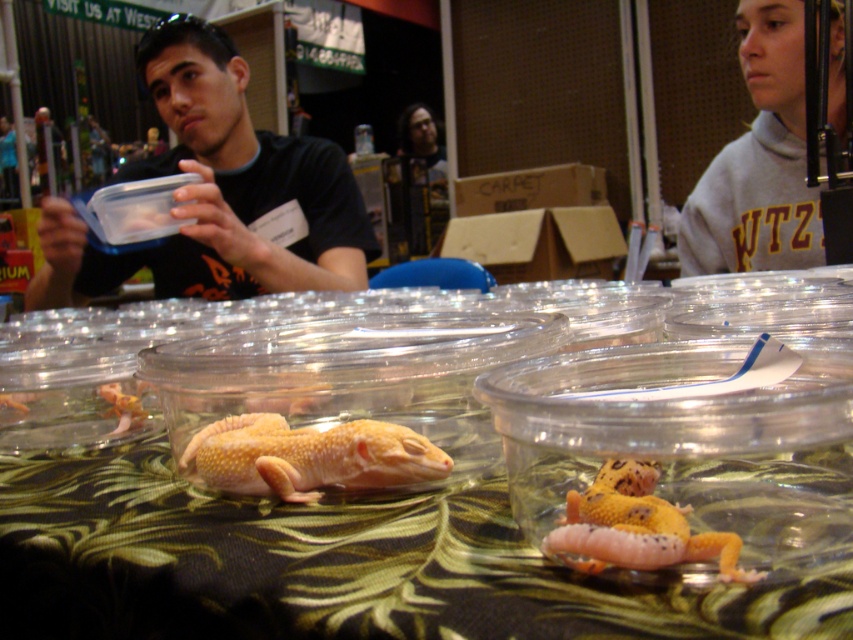
You are a photographer at the reptile expo and need to capture a photo that includes both the matte black shirt at upper left and the gray fleece sweatshirt at upper right. What is the minimum distance you need to move your camera backward to ensure both are in frame?

The minimum distance to move the camera backward would depend on the camera lens and sensor size, but since the two subjects are 1.05 meters apart, you need to ensure the camera can capture a field of view wide enough to include both the matte black shirt at upper left and the gray fleece sweatshirt at upper right within the frame.

You are a customer at the reptile expo and want to compare the height of the gray fleece sweatshirt at upper right and the yellowish matte lizard at center. Which one is taller?

The gray fleece sweatshirt at upper right is taller than the yellowish matte lizard at center.

You are a person who is 1.6 meters tall and standing at the position of the viewer. You want to pick up the gray fleece sweatshirt at upper right without moving your feet. Can you reach it?

The gray fleece sweatshirt at upper right and viewer are 1.39 meters apart from each other. Since the distance between you and the sweatshirt is 1.39 meters, and your height is 1.6 meters, you can likely reach it by stretching your arm forward and upward as the horizontal distance is within a typical arm reach for most adults.